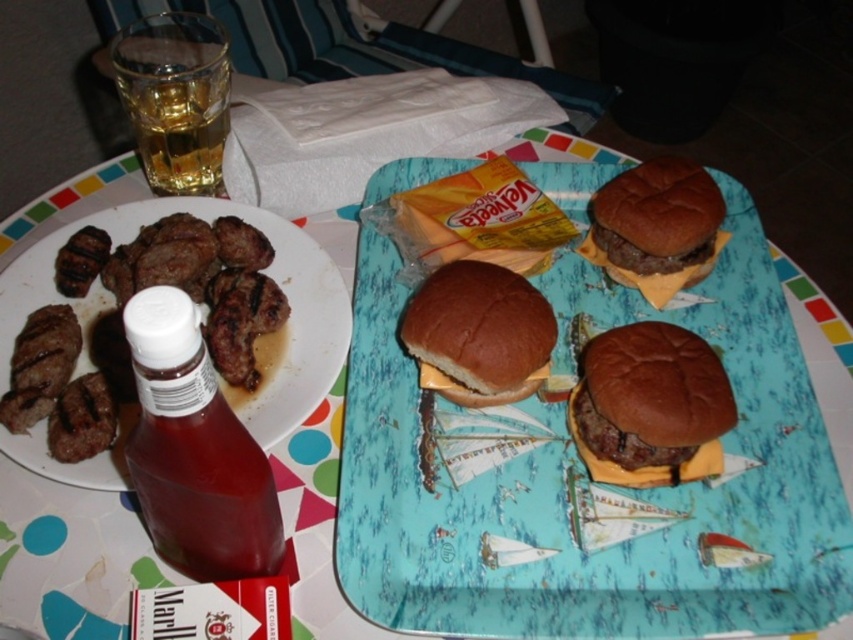
Question: Does blue paper tray at center appear under translucent glass at upper left?

Choices:
 (A) no
 (B) yes

Answer: (B)

Question: Does brown charred meat at left have a larger size compared to translucent plastic bottle at lower left?

Choices:
 (A) no
 (B) yes

Answer: (B)

Question: Among these points, which one is farthest from the camera?

Choices:
 (A) (503, 380)
 (B) (62, 451)
 (C) (125, 99)
 (D) (753, 388)

Answer: (C)

Question: Which of the following is the farthest from the observer?

Choices:
 (A) (219, 112)
 (B) (625, 275)
 (C) (253, 561)
 (D) (354, 276)

Answer: (D)

Question: Can you confirm if brown matte cheeseburger at center is thinner than brown matte burger at center?

Choices:
 (A) no
 (B) yes

Answer: (B)

Question: Among these points, which one is farthest from the camera?

Choices:
 (A) (643, 253)
 (B) (268, 243)
 (C) (144, 445)

Answer: (B)